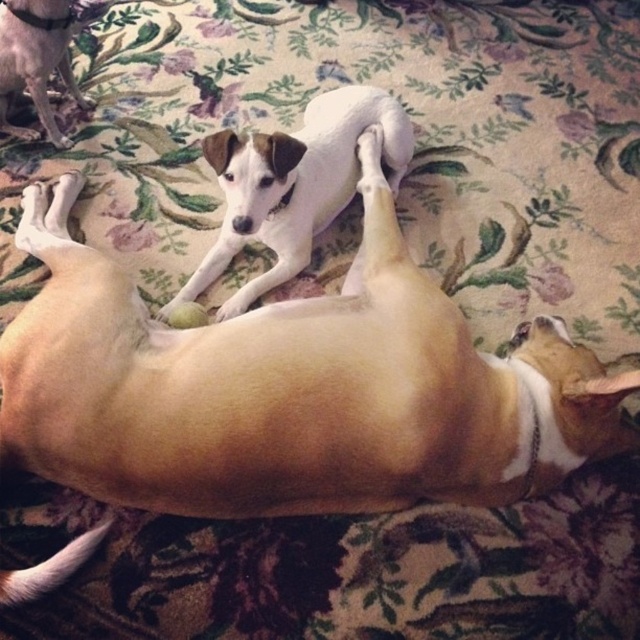
Question: Does white smooth dog at center come in front of white fur dog at upper left?

Choices:
 (A) yes
 (B) no

Answer: (A)

Question: Is light brown fur at center smaller than white smooth dog at center?

Choices:
 (A) no
 (B) yes

Answer: (A)

Question: Which point appears closest to the camera in this image?

Choices:
 (A) (310, 432)
 (B) (45, 118)

Answer: (A)

Question: Considering the relative positions of light brown fur at center and white fur dog at upper left in the image provided, where is light brown fur at center located with respect to white fur dog at upper left?

Choices:
 (A) right
 (B) left

Answer: (A)

Question: Which point is closer to the camera?

Choices:
 (A) (369, 218)
 (B) (33, 49)
 (C) (291, 227)

Answer: (A)

Question: Which point appears closest to the camera in this image?

Choices:
 (A) (3, 99)
 (B) (177, 451)
 (C) (237, 307)

Answer: (B)